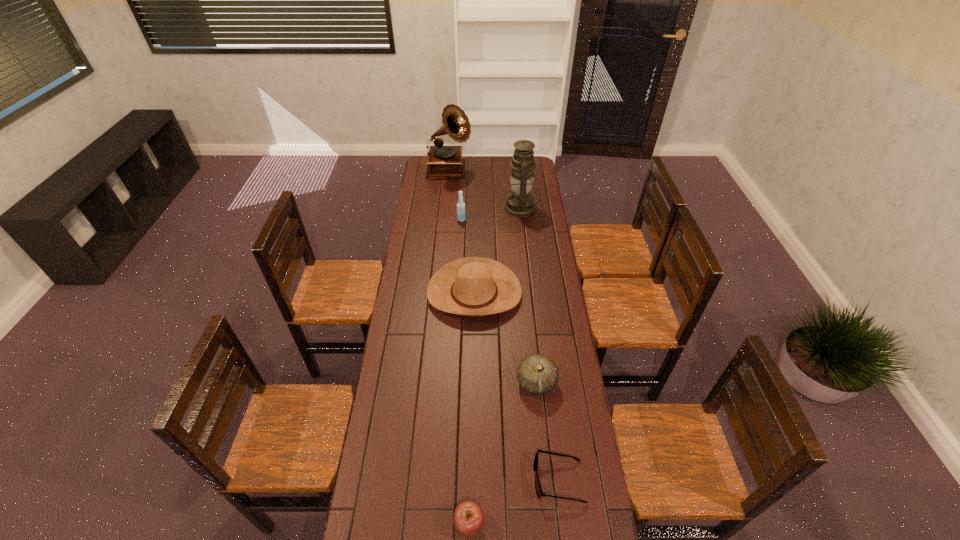
Locate an element on the screen. The image size is (960, 540). oil lamp that is at the right edge is located at coordinates (520, 203).

Find the location of a particular element. gourd positioned at the right edge is located at coordinates (537, 374).

Identify the location of sunglasses at the right edge. This screenshot has width=960, height=540. (538, 488).

In order to click on object that is at the far left corner in this screenshot , I will do `click(444, 162)`.

In the image, there is a desktop. Identify the location of vacant space at the far edge. (466, 168).

Locate an element on the screen. Image resolution: width=960 pixels, height=540 pixels. blank space at the left edge is located at coordinates 411,285.

I want to click on vacant area at the right edge of the desktop, so coord(535,218).

This screenshot has width=960, height=540. I want to click on free space at the far right corner, so click(x=536, y=176).

The height and width of the screenshot is (540, 960). What are the coordinates of `free point between the sixth farthest object and the third tallest object` in the screenshot? It's located at (510, 349).

The width and height of the screenshot is (960, 540). Find the location of `free space between the gourd and the oil lamp`. free space between the gourd and the oil lamp is located at coordinates (529, 295).